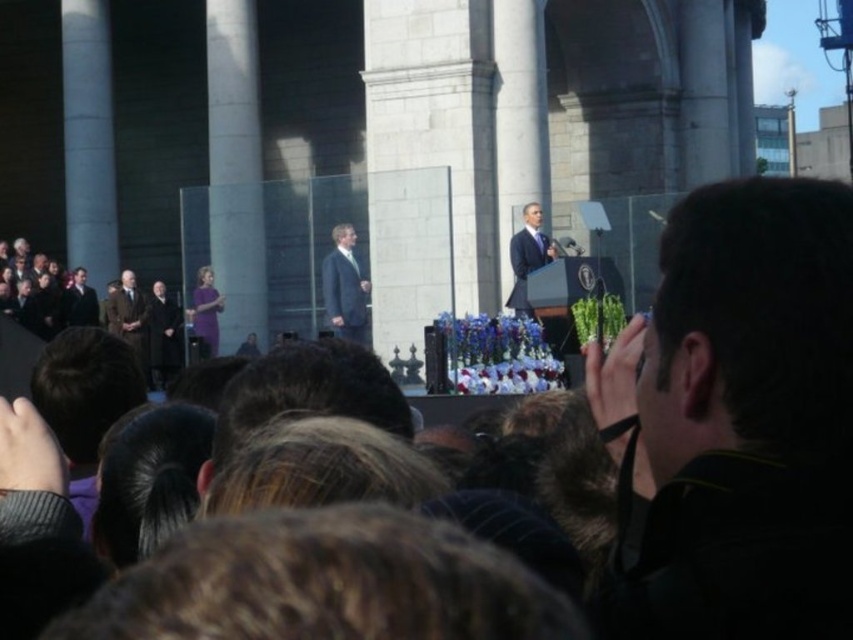
You are a photographer at the event and want to capture both the dark gray suit at left and the purple fabric dress at center in a single frame. Given their sizes, which one might appear larger in the photo?

The dark gray suit at left is bigger than the purple fabric dress at center, so it will appear larger in the photo.

You are organizing a photo shoot and need to place a camera stand between the dark suit at center and the brown suit at left. Given that the camera stand requires 1 meter of space, can it fit between them?

The dark suit at center is thinner than the brown suit at left, but the description does not provide information about the distance between them. Therefore, it is impossible to determine if the camera stand will fit based on the given details.